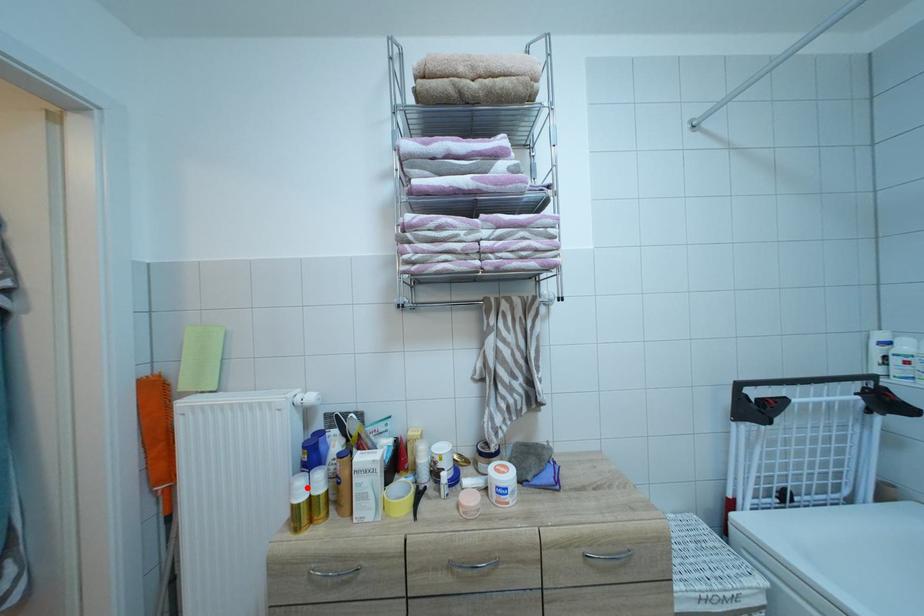
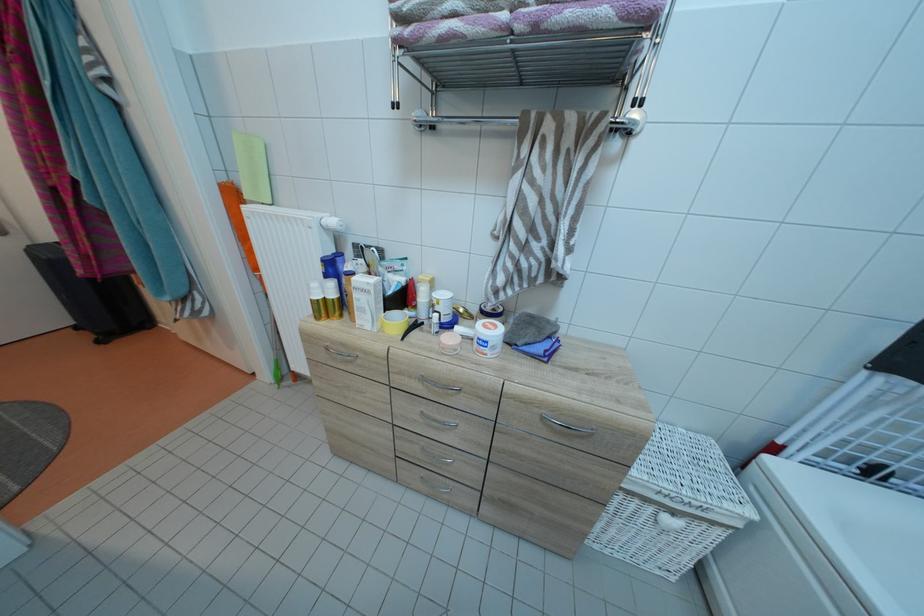
Question: I am providing you with two images of the same scene from different viewpoints. A red point is marked on the first image. Is the red point's position out of view in image 2?

Choices:
 (A) Yes
 (B) No

Answer: (B)